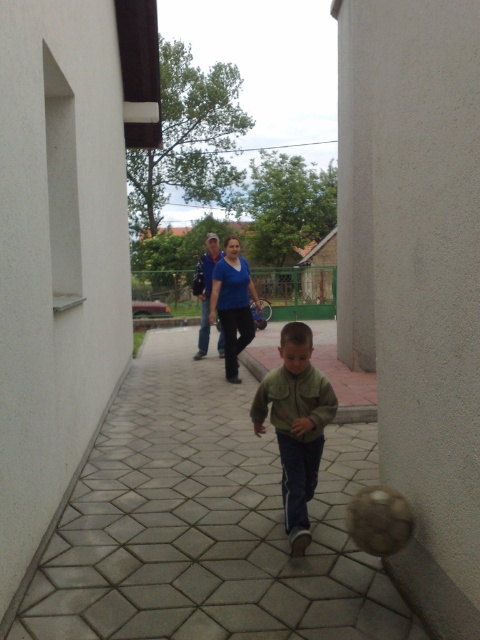
You are standing at the point marked as point (204, 524). What is the color and shape of the surface you are standing on?

The surface at point (204, 524) is gray hexagonal tiles at center.

You are standing on the gray hexagonal tiles at center and looking up. Which direction should you look to see the green matte jacket at center?

The gray hexagonal tiles at center are located below the green matte jacket at center, so you should look upward to see the green matte jacket at center.